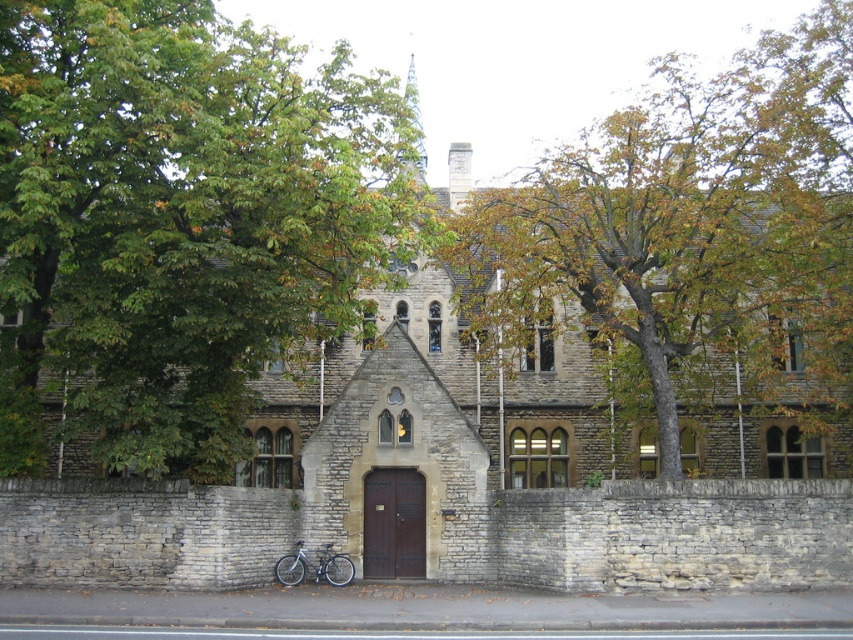
You are standing in front of the historic stone building and want to take a photo of the green leafy tree at upper left. Where should you position yourself to capture it in the frame?

The green leafy tree at upper left is located at the upper left corner of the image, so to capture it in the frame, you should position yourself to the lower right side of the building to ensure the tree is visible in the upper left portion of your camera viewfinder.

Based on the photo, you are standing in front of the stone church at center and looking towards the green leafy tree at upper center. Which object appears larger in your view?

The green leafy tree at upper center appears larger than the stone church at center in your view.

You are standing in front of the historic stone building and notice a green leafy tree at upper center and a stone church at center. Which object has a narrower width?

The green leafy tree at upper center is thinner than the stone church at center, so the green leafy tree at upper center has a narrower width.